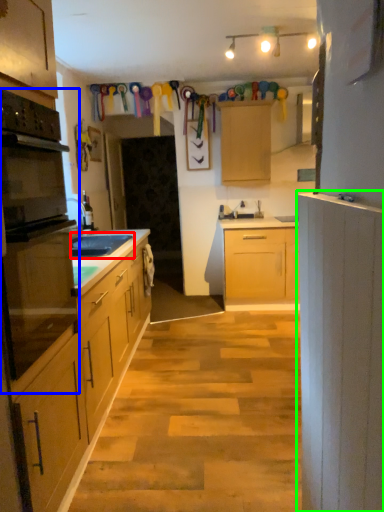
Question: Which is farther away from sink (highlighted by a red box)? oven (highlighted by a blue box) or cabinetry (highlighted by a green box)?

Choices:
 (A) oven
 (B) cabinetry

Answer: (B)